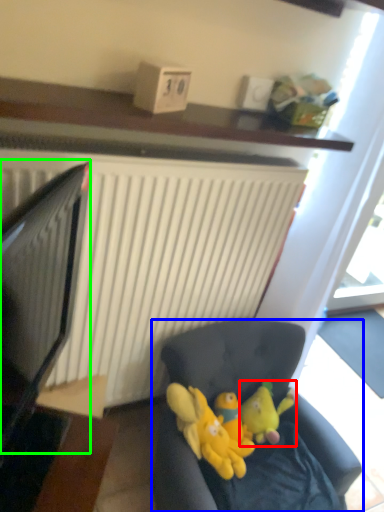
Question: Which is nearer to the toy (highlighted by a red box)? studio couch (highlighted by a blue box) or computer monitor (highlighted by a green box).

Choices:
 (A) studio couch
 (B) computer monitor

Answer: (A)